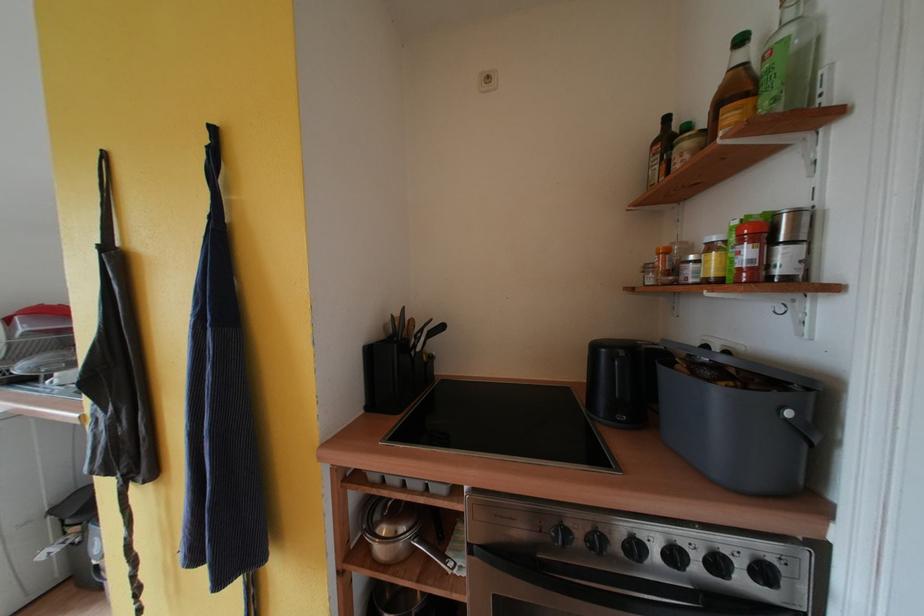
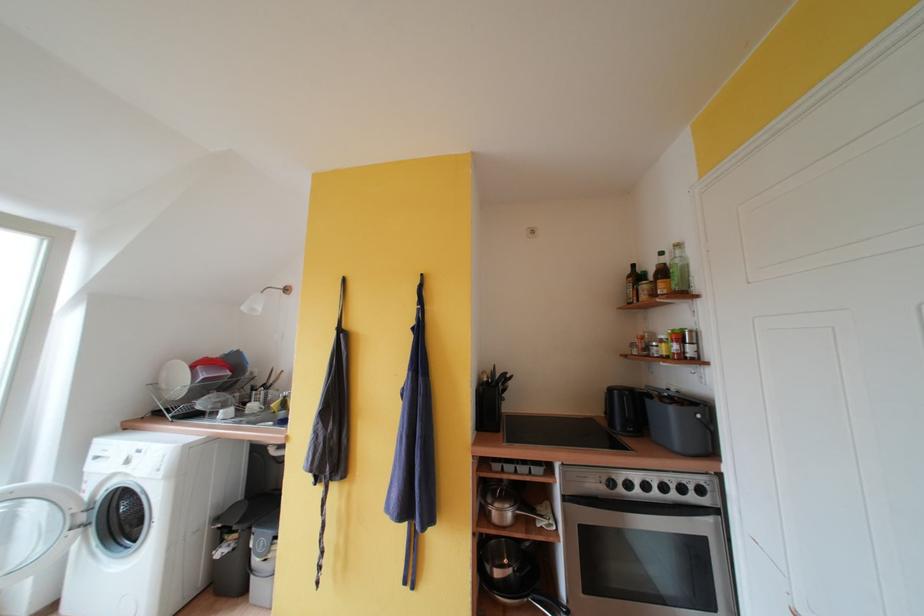
Question: I am providing you with two images of the same scene from different viewpoints. Please identify which objects are invisible in image2.

Choices:
 (A) gray toaster
 (B) oven door handle
 (C) white plate
 (D) none of these

Answer: (D)